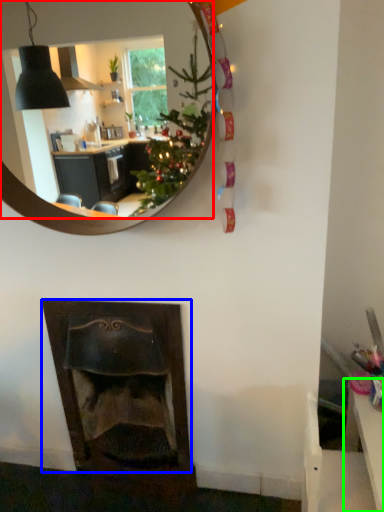
Question: Which object is positioned closest to mirror (highlighted by a red box)? Select from fireplace (highlighted by a blue box) and table (highlighted by a green box).

Choices:
 (A) fireplace
 (B) table

Answer: (A)